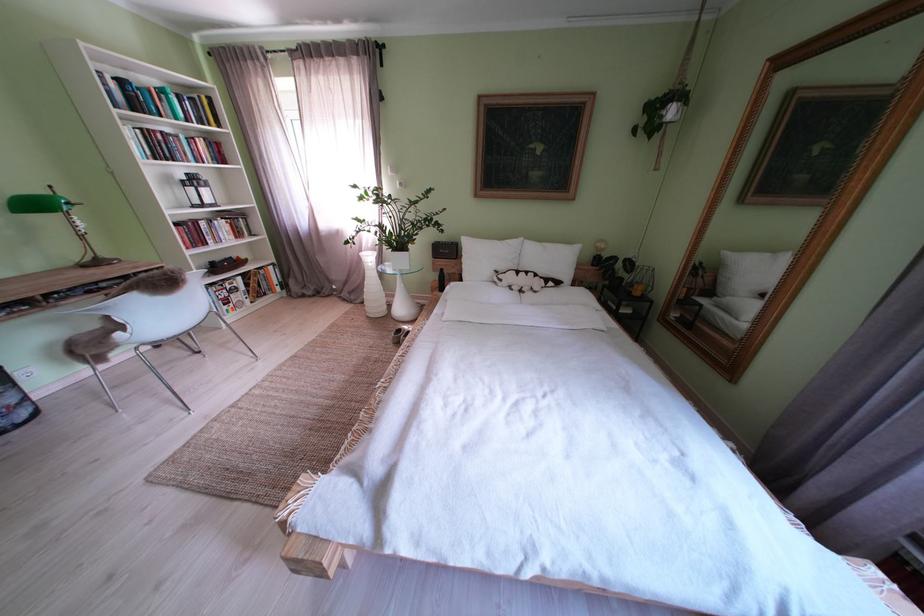
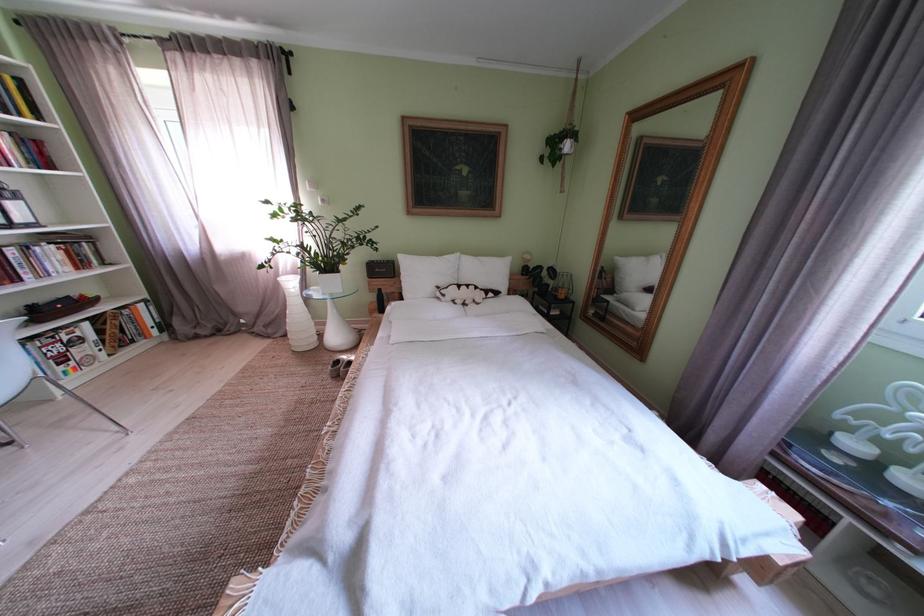
Find the pixel in the second image that matches (x=248, y=294) in the first image.

(92, 344)